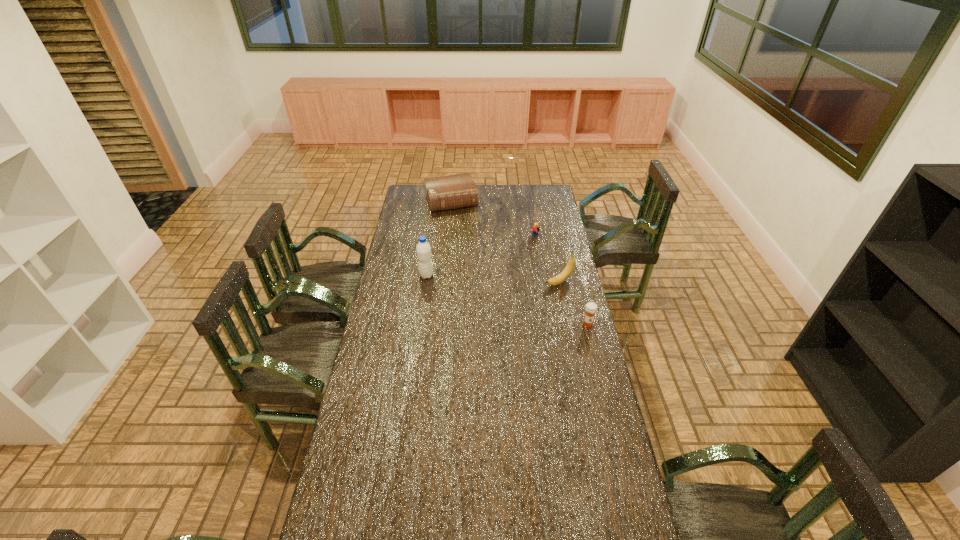
Locate an element on the screen. vacant position located at the start of the peel on the fourth shortest object is located at coordinates (496, 314).

This screenshot has width=960, height=540. Identify the location of vacant space located at the start of the peel on the fourth shortest object. (527, 298).

At what (x,y) coordinates should I click in order to perform the action: click on free spot located 0.310m at the start of the peel on the fourth shortest object. Please return your answer as a coordinate pair (x, y). Image resolution: width=960 pixels, height=540 pixels. Looking at the image, I should click on (496, 314).

Identify the location of free location located 0.140m on the spine side of the farthest object. (462, 228).

Locate an element on the screen. This screenshot has width=960, height=540. vacant point located 0.370m on the spine side of the farthest object is located at coordinates (471, 252).

This screenshot has width=960, height=540. I want to click on vacant region located 0.160m on the spine side of the farthest object, so click(x=463, y=230).

The height and width of the screenshot is (540, 960). Find the location of `object located in the far edge section of the desktop`. object located in the far edge section of the desktop is located at coordinates (450, 192).

Where is `water bottle at the left edge`? Image resolution: width=960 pixels, height=540 pixels. water bottle at the left edge is located at coordinates (423, 249).

At what (x,y) coordinates should I click in order to perform the action: click on Bible located at the left edge. Please return your answer as a coordinate pair (x, y). Image resolution: width=960 pixels, height=540 pixels. Looking at the image, I should click on (450, 192).

Find the location of `medicine present at the right edge`. medicine present at the right edge is located at coordinates (591, 308).